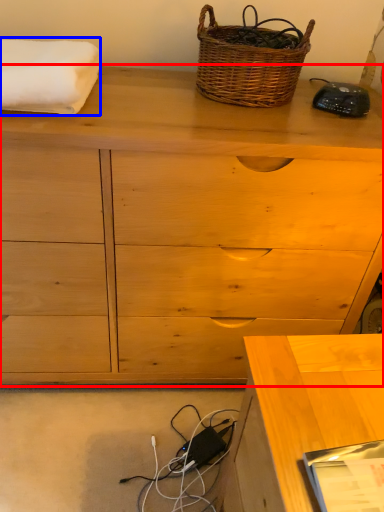
Question: Among these objects, which one is nearest to the camera, chest of drawers (highlighted by a red box) or bath towel (highlighted by a blue box)?

Choices:
 (A) chest of drawers
 (B) bath towel

Answer: (A)